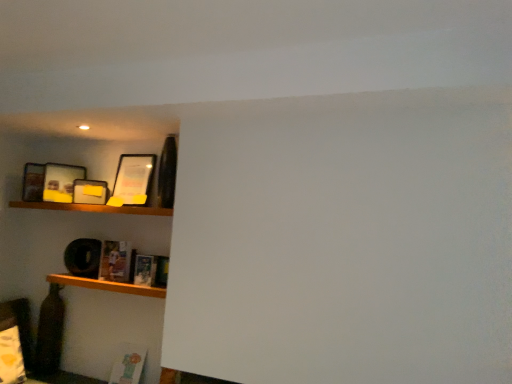
Question: In the image, is wooden shelf at lower left, which ranks as the 1th shelf in bottom-to-top order, on the left side or the right side of matte paper book at lower left, the second book in the front-to-back sequence?

Choices:
 (A) right
 (B) left

Answer: (B)

Question: From a real-world perspective, is wooden shelf at lower left, which ranks as the 1th shelf in bottom-to-top order, above or below matte paper book at lower left, arranged as the first book when viewed from the back?

Choices:
 (A) above
 (B) below

Answer: (B)

Question: Which object is the farthest from the hardcover book at lower left, the first book from the right?

Choices:
 (A) matte wooden picture frame at upper left, the third picture frame viewed from the left
 (B) wooden shelf at upper left, the second shelf positioned from the bottom
 (C) matte yellow picture frame at upper left, the second picture frame when ordered from right to left
 (D) matte paper book at lower left, arranged as the first book when viewed from the back
 (E) matte black picture frame at upper left, the third picture frame in the right-to-left sequence

Answer: (E)

Question: Based on their relative distances, which object is farther from the matte yellow picture frame at upper left, the second picture frame when ordered from right to left?

Choices:
 (A) wooden shelf at lower left, the 2th shelf when ordered from top to bottom
 (B) matte wooden picture frame at upper left, the third picture frame viewed from the left
 (C) wooden shelf at upper left, marked as the 1th shelf in a top-to-bottom arrangement
 (D) hardcover book at lower left, the first book in the front-to-back sequence
 (E) matte black picture frame at upper left, arranged as the first picture frame when viewed from the left

Answer: (A)